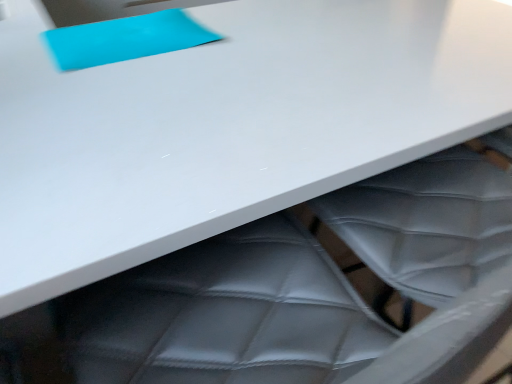
Identify the location of blue matte notepad at upper left. This screenshot has height=384, width=512. (125, 39).

What do you see at coordinates (125, 39) in the screenshot? I see `blue matte notepad at upper left` at bounding box center [125, 39].

Where is `blue matte notepad at upper left`? blue matte notepad at upper left is located at coordinates (125, 39).